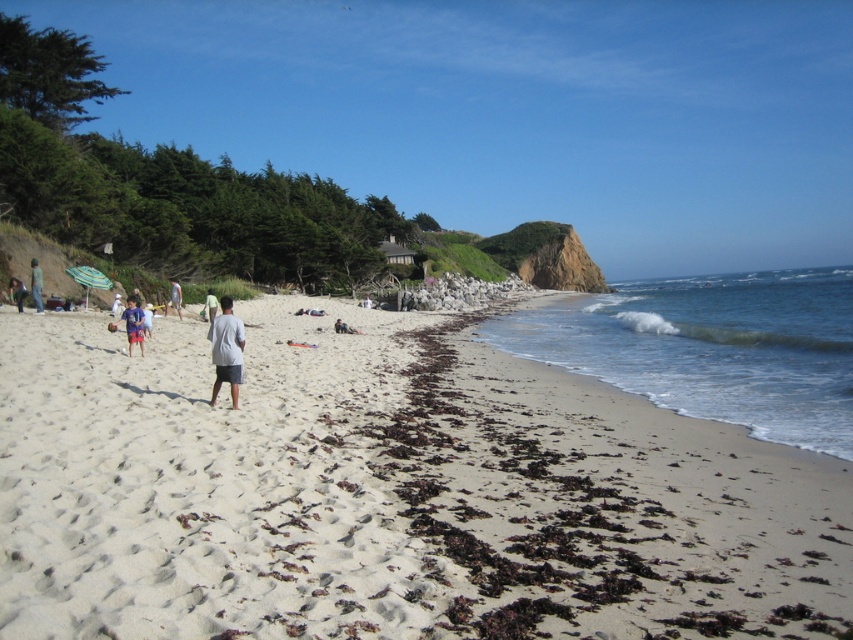
Question: Considering the real-world distances, which object is closest to the matte gray shorts at center?

Choices:
 (A) white sandy beach at center
 (B) blue cotton shorts at lower left

Answer: (B)

Question: Does blue cotton shorts at lower left appear on the left side of matte gray shorts at center?

Choices:
 (A) no
 (B) yes

Answer: (A)

Question: Is white sandy beach at center further to camera compared to blue cotton shorts at lower left?

Choices:
 (A) yes
 (B) no

Answer: (B)

Question: Which of these objects is positioned farthest from the blue cotton shorts at lower left?

Choices:
 (A) matte gray shorts at center
 (B) white sandy beach at center

Answer: (B)

Question: Which point is farther from the camera taking this photo?

Choices:
 (A) (583, 545)
 (B) (219, 388)
 (C) (33, 294)

Answer: (C)

Question: Is white sandy beach at center above gray cotton shirt at center?

Choices:
 (A) yes
 (B) no

Answer: (B)